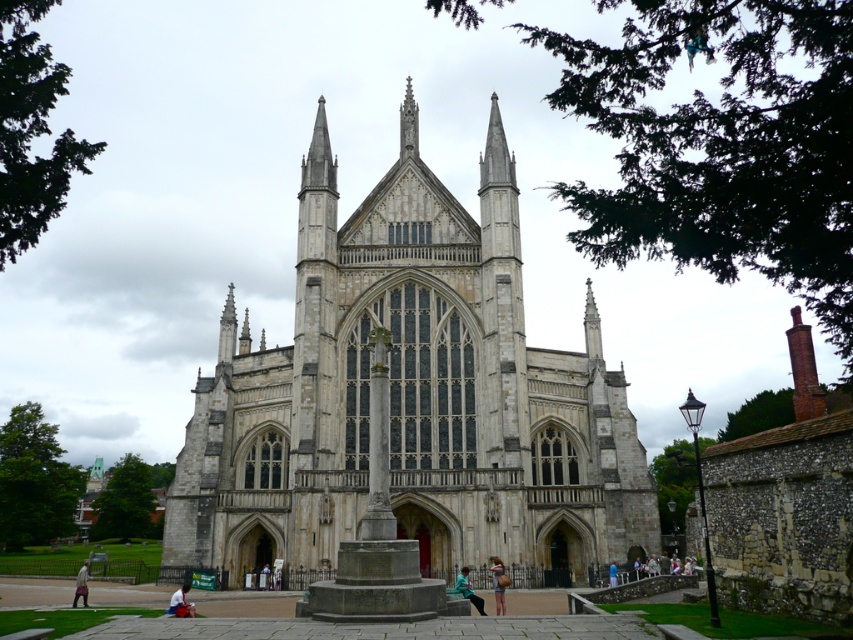
You are standing in front of the cathedral and notice a green leafy tree at upper left and a green fabric jacket at lower center. Which object is closer to you from your current viewpoint?

The green leafy tree at upper left is in front of the green fabric jacket at lower center, so it is closer to you.